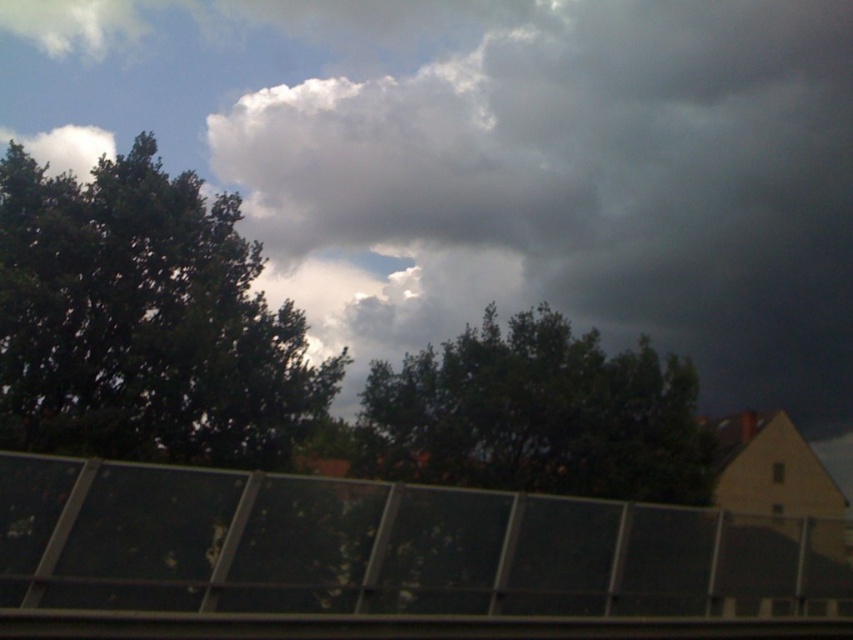
From the picture: You are standing in front of the solar panels in the foreground. Looking up, you see the dark gray cloud at upper center and the dark green leafy tree at center. Which object is positioned to the right when comparing the two?

The dark gray cloud at upper center is positioned to the right of the dark green leafy tree at center.

You are an astronomer observing the sky. You notice the dark gray cloud at upper center and the green leafy tree at left. Which object is positioned more to the east if the image is oriented with north at the top?

The dark gray cloud at upper center is positioned more to the east because it is to the right of the green leafy tree at left, and since the image is oriented with north at the top, right corresponds to east.

You are a weather observer trying to track storm patterns. You notice the dark gray cloud at upper center and the green leafy tree at left in the image. Which object is directly above the other?

The dark gray cloud at upper center is positioned over the green leafy tree at left, meaning it is directly above it.